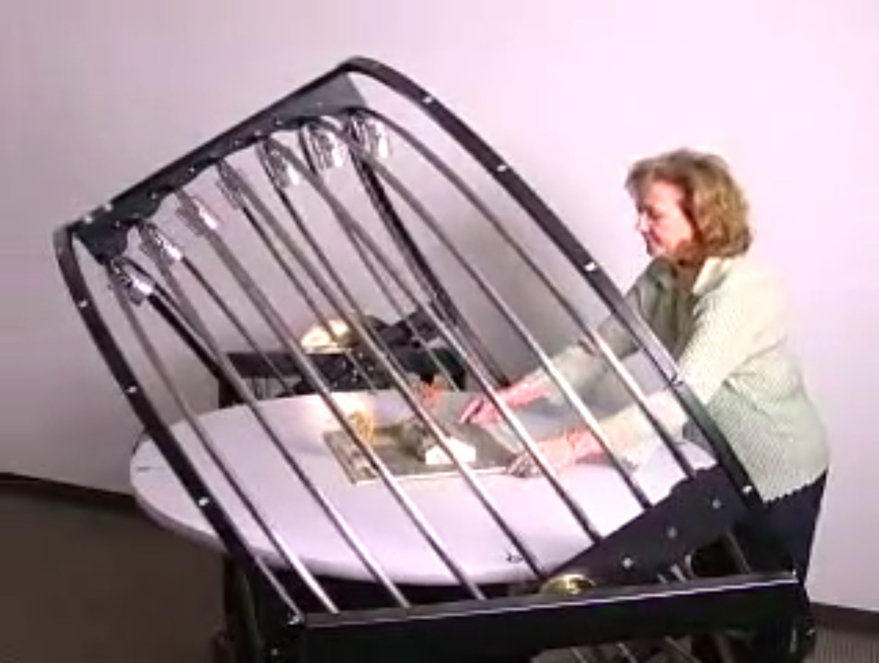
Where is `table`? The height and width of the screenshot is (663, 879). table is located at coordinates (453, 538).